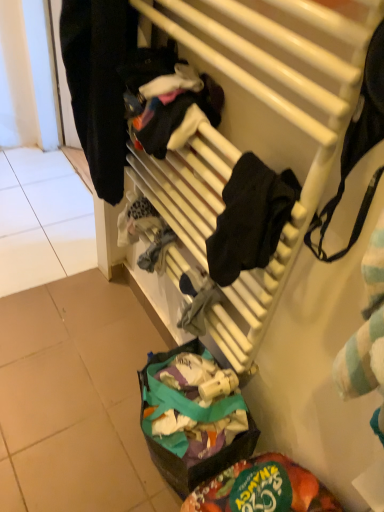
Question: Is black matte clothing at left closer to camera compared to green fabric bag at lower center?

Choices:
 (A) no
 (B) yes

Answer: (B)

Question: Considering the relative positions of black matte clothing at left and green fabric bag at lower center in the image provided, is black matte clothing at left to the right of green fabric bag at lower center from the viewer's perspective?

Choices:
 (A) yes
 (B) no

Answer: (B)

Question: Is black matte clothing at left not close to green fabric bag at lower center?

Choices:
 (A) no
 (B) yes

Answer: (A)

Question: From a real-world perspective, is black matte clothing at left under green fabric bag at lower center?

Choices:
 (A) no
 (B) yes

Answer: (A)

Question: From the image's perspective, does black matte clothing at left appear lower than green fabric bag at lower center?

Choices:
 (A) no
 (B) yes

Answer: (A)

Question: Is black matte clothing at left wider than green fabric bag at lower center?

Choices:
 (A) yes
 (B) no

Answer: (B)

Question: Are white matte radiator at upper center and black matte clothing at left far apart?

Choices:
 (A) yes
 (B) no

Answer: (B)

Question: Could you tell me if white matte radiator at upper center is turned towards black matte clothing at left?

Choices:
 (A) yes
 (B) no

Answer: (B)

Question: Can you confirm if white matte radiator at upper center is shorter than black matte clothing at left?

Choices:
 (A) yes
 (B) no

Answer: (B)

Question: Does white matte radiator at upper center appear on the right side of black matte clothing at left?

Choices:
 (A) no
 (B) yes

Answer: (B)

Question: From the image's perspective, is white matte radiator at upper center over black matte clothing at left?

Choices:
 (A) yes
 (B) no

Answer: (B)

Question: Is the position of white matte radiator at upper center less distant than that of black matte clothing at left?

Choices:
 (A) no
 (B) yes

Answer: (B)

Question: Does white matte radiator at upper center appear on the left side of green fabric bag at lower center?

Choices:
 (A) no
 (B) yes

Answer: (B)